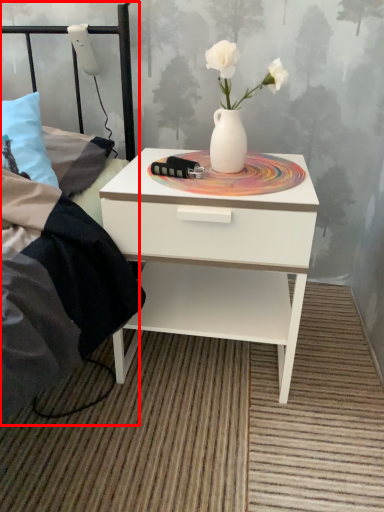
Question: Considering the relative positions of bed frame (annotated by the red box) and nightstand in the image provided, where is bed frame (annotated by the red box) located with respect to the staircase?

Choices:
 (A) left
 (B) right

Answer: (A)